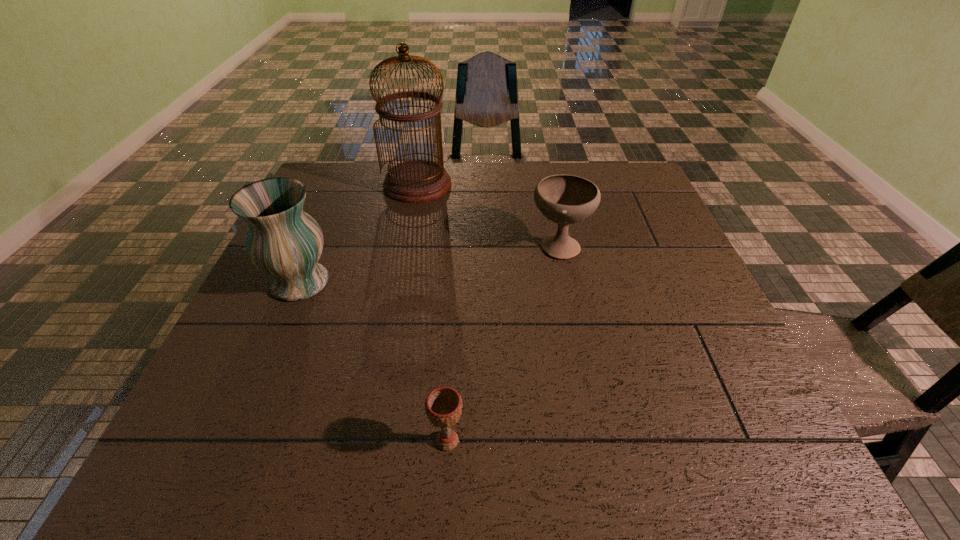
I want to click on vacant space at the far right corner of the desktop, so click(596, 172).

Find the location of a particular element. blank region between the third shortest object and the left chalice is located at coordinates click(x=373, y=361).

I want to click on free area in between the third object from left to right and the rightmost object, so click(503, 343).

Locate an element on the screen. This screenshot has width=960, height=540. empty space that is in between the vase and the rightmost object is located at coordinates point(430,264).

This screenshot has width=960, height=540. Find the location of `free space between the farthest object and the shortest object`. free space between the farthest object and the shortest object is located at coordinates (432, 313).

The width and height of the screenshot is (960, 540). I want to click on free space between the tallest object and the shortest object, so click(x=432, y=313).

Locate an element on the screen. The width and height of the screenshot is (960, 540). empty space between the taller chalice and the second tallest object is located at coordinates (430, 264).

Where is `unoccupied position between the tallest object and the nearest object`? This screenshot has height=540, width=960. unoccupied position between the tallest object and the nearest object is located at coordinates [x=432, y=313].

This screenshot has width=960, height=540. What are the coordinates of `vacant point located between the nearest object and the third shortest object` in the screenshot? It's located at (373, 361).

The width and height of the screenshot is (960, 540). I want to click on free area in between the third shortest object and the farther chalice, so click(x=430, y=264).